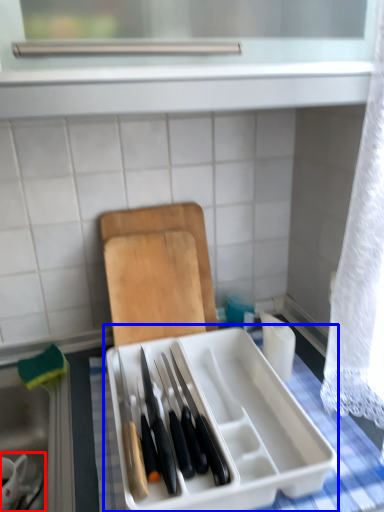
Question: Which object appears farthest to the camera in this image, tableware (highlighted by a red box) or appliance (highlighted by a blue box)?

Choices:
 (A) tableware
 (B) appliance

Answer: (A)